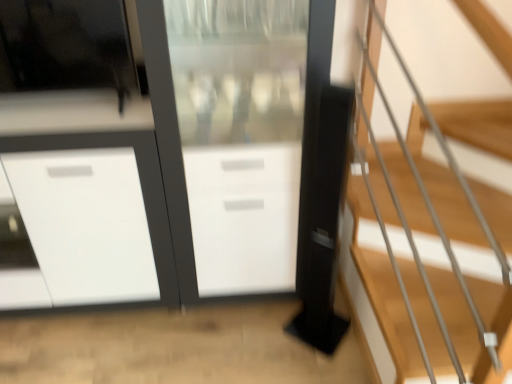
Question: In terms of size, does white glossy cabinet at center appear bigger or smaller than transparent glass screen door at center?

Choices:
 (A) small
 (B) big

Answer: (B)

Question: Is white glossy cabinet at center to the left or to the right of transparent glass screen door at center in the image?

Choices:
 (A) right
 (B) left

Answer: (B)

Question: Considering the real-world distances, which object is closest to the transparent glass screen door at center?

Choices:
 (A) white glossy cabinet at center
 (B) wooden stairs at right

Answer: (A)

Question: Which object is the farthest from the wooden stairs at right?

Choices:
 (A) transparent glass screen door at center
 (B) white glossy cabinet at center

Answer: (B)